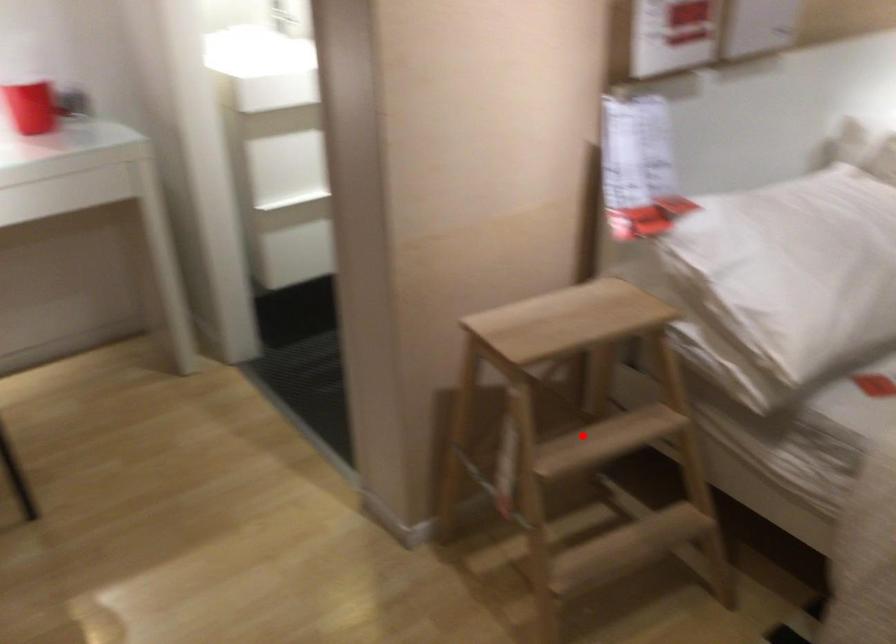
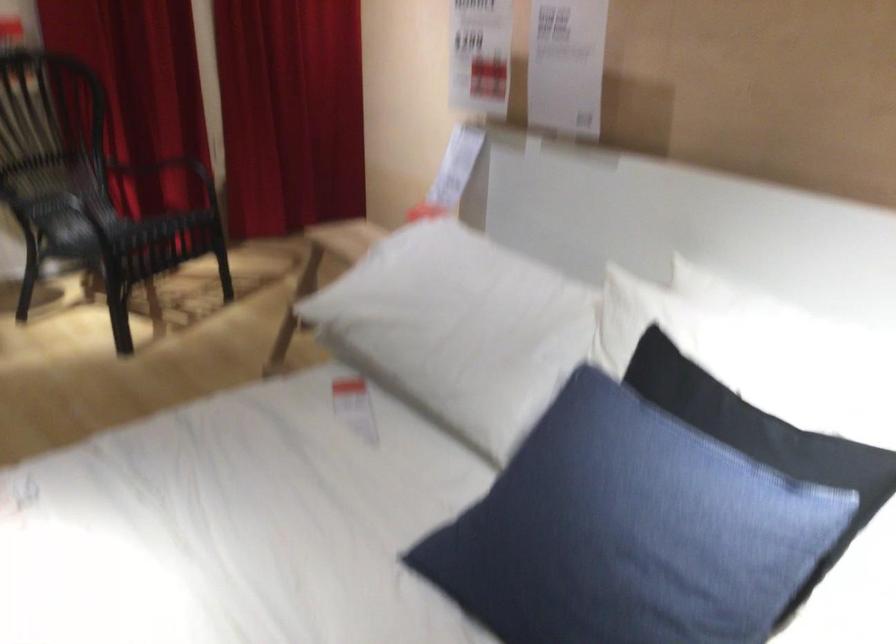
Question: I am providing you with two images of the same scene from different viewpoints. A red point is marked on the first image. Is the red point's position out of view in image 2?

Choices:
 (A) Yes
 (B) No

Answer: (A)